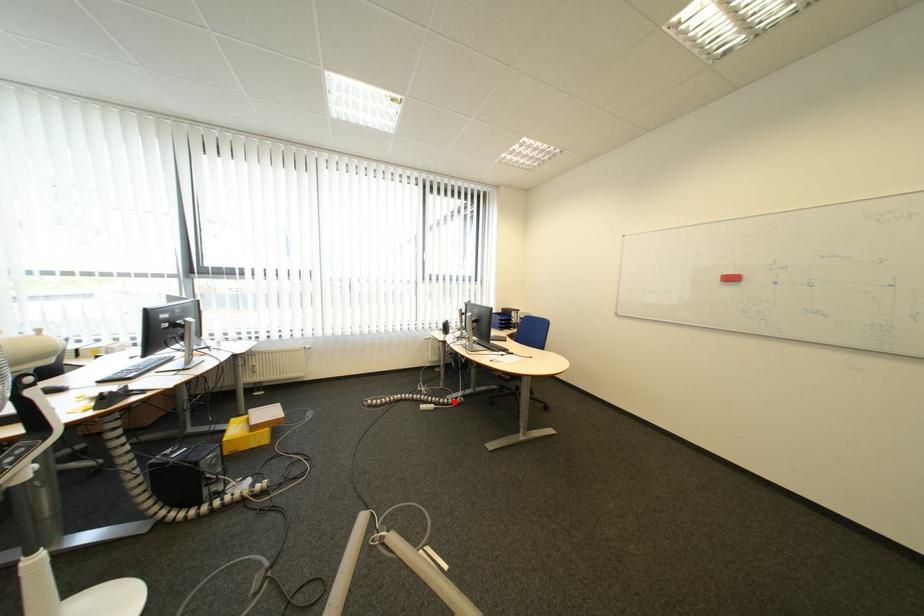
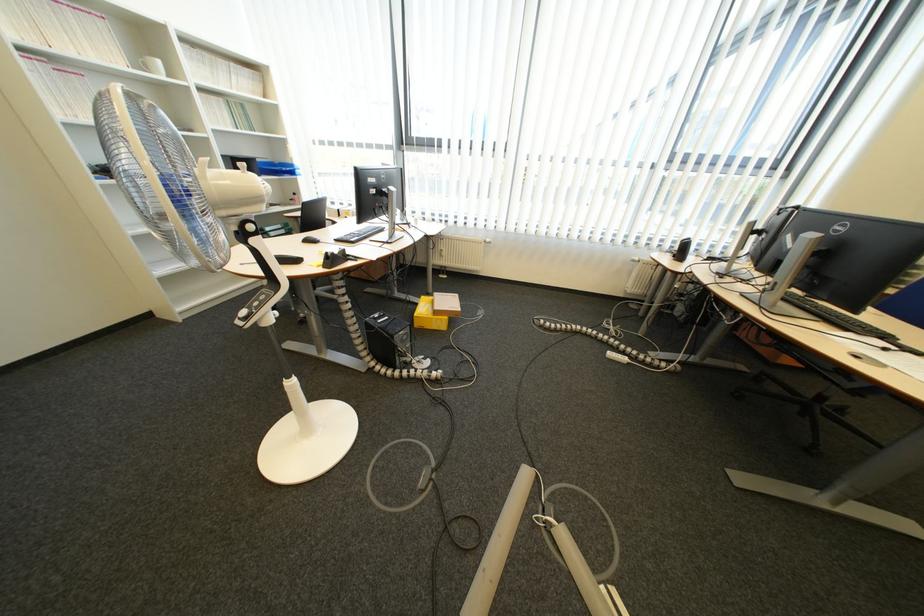
Question: I am providing you with two images of the same scene from different viewpoints. A red point is marked on the first image. At the location where the point appears in image 1, is it still visible in image 2?

Choices:
 (A) Yes
 (B) No

Answer: (A)